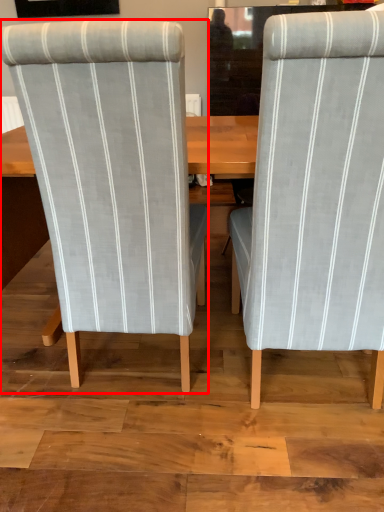
Question: From the image's perspective, where is chair (annotated by the red box) located in relation to chair in the image?

Choices:
 (A) above
 (B) below

Answer: (A)